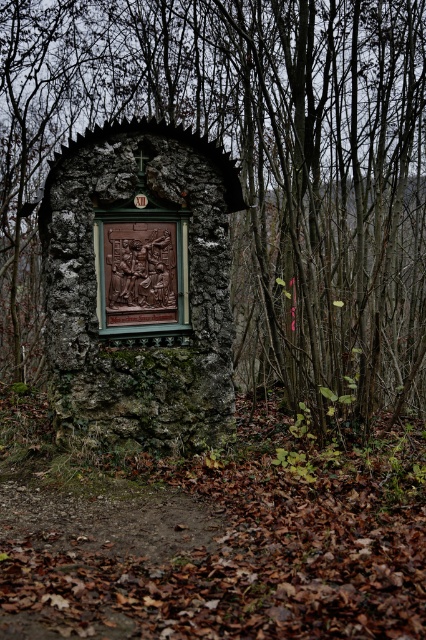
Is brown stone carving at center taller than brown carved stone at center?

In fact, brown stone carving at center may be shorter than brown carved stone at center.

Who is higher up, brown stone carving at center or brown carved stone at center?

brown stone carving at center is higher up.

Is point (296, 154) more distant than point (149, 419)?

That is True.

Find the location of a particular element. The height and width of the screenshot is (640, 426). brown stone carving at center is located at coordinates (247, 164).